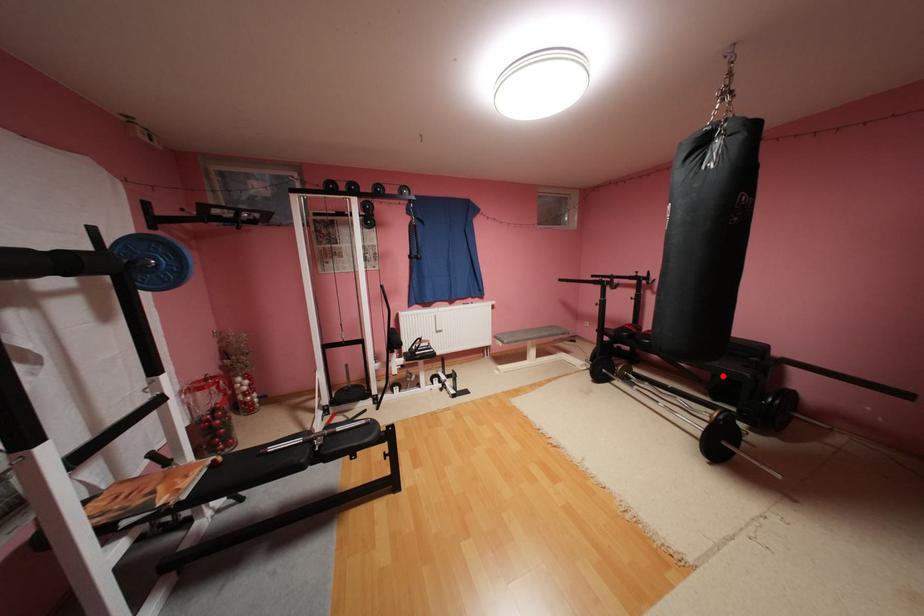
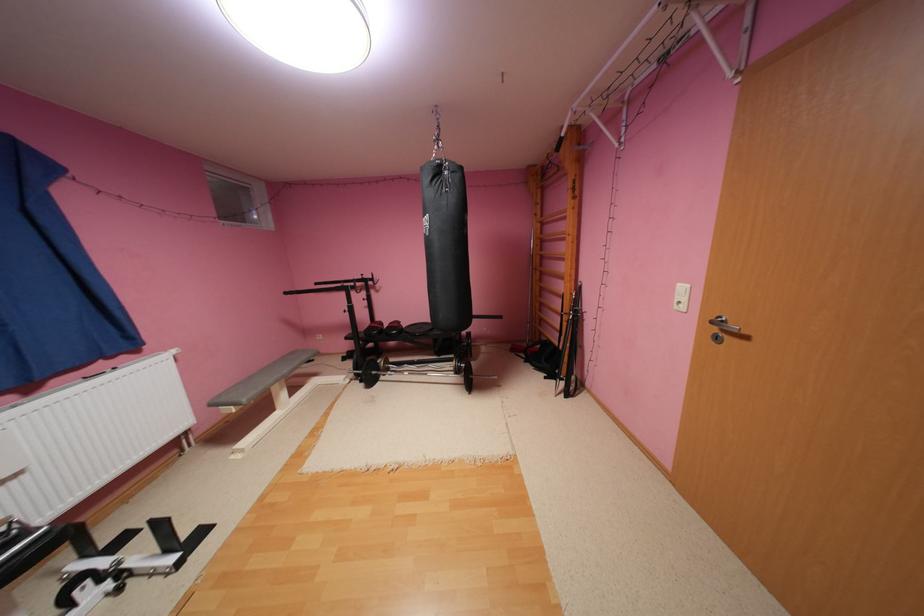
Question: I am providing you with two images of the same scene from different viewpoints. In image1, a red point is highlighted. Considering the same 3D point in image2, which of the following is correct?

Choices:
 (A) It is closer
 (B) It is farther

Answer: (B)